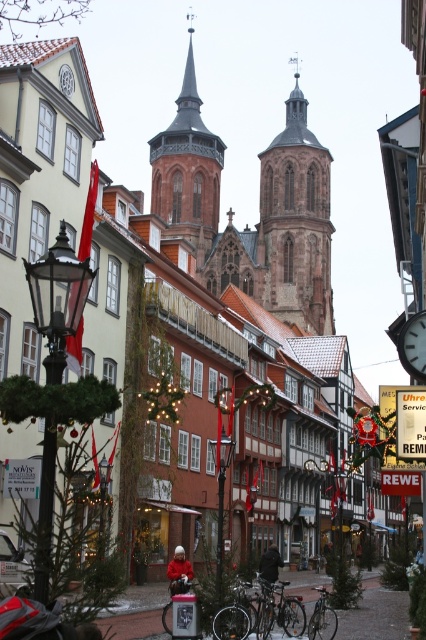
Who is positioned more to the left, reddish-brown stone bell tower at center or metallic clock at center?

reddish-brown stone bell tower at center

Is reddish-brown stone bell tower at center shorter than metallic clock at center?

No, reddish-brown stone bell tower at center is not shorter than metallic clock at center.

Where is `reddish-brown stone bell tower at center`? This screenshot has width=426, height=640. reddish-brown stone bell tower at center is located at coordinates (187, 170).

Does brown stone bell tower at center have a smaller size compared to metallic clock at center?

Actually, brown stone bell tower at center might be larger than metallic clock at center.

Which is behind, point (299, 289) or point (417, 333)?

Point (299, 289)

The height and width of the screenshot is (640, 426). Identify the location of brown stone bell tower at center. (296, 221).

Looking at this image, between brown stone bell tower at center and reddish-brown stone bell tower at center, which one has less height?

With less height is brown stone bell tower at center.

Is brown stone bell tower at center taller than reddish-brown stone bell tower at center?

No.

What do you see at coordinates (296, 221) in the screenshot? I see `brown stone bell tower at center` at bounding box center [296, 221].

Find the location of `brown stone bell tower at center`. brown stone bell tower at center is located at coordinates (296, 221).